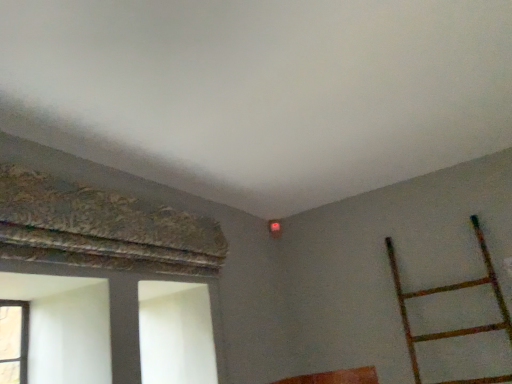
Describe the element at coordinates (449, 291) in the screenshot. The image size is (512, 384). I see `wooden at right` at that location.

Measure the distance between point (399, 293) and camera.

Point (399, 293) and camera are 6.87 feet apart from each other.

The width and height of the screenshot is (512, 384). In order to click on wooden at right in this screenshot , I will do `click(449, 291)`.

At what (x,y) coordinates should I click in order to perform the action: click on wooden at right. Please return your answer as a coordinate pair (x, y). Image resolution: width=512 pixels, height=384 pixels. Looking at the image, I should click on (449, 291).